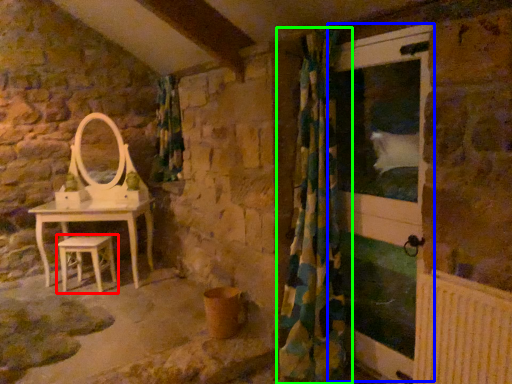
Question: Based on their relative distances, which object is farther from stool (highlighted by a red box)? Choose from screen door (highlighted by a blue box) and curtain (highlighted by a green box).

Choices:
 (A) screen door
 (B) curtain

Answer: (A)